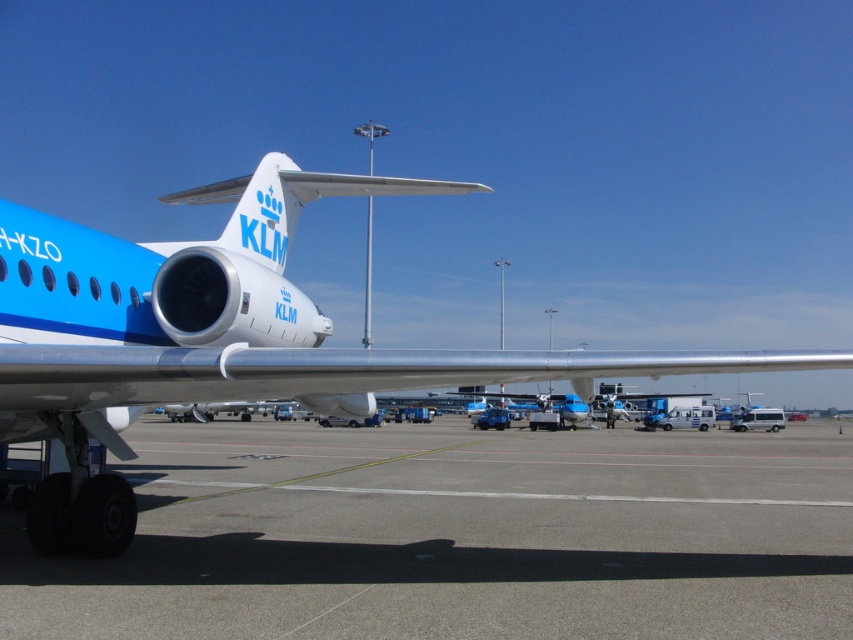
From the picture: You are an airport ground crew member who needs to ensure that the matte blue airplane at center can safely taxi along the gray concrete runway at center. Based on the provided scene description, can the airplane fit on the runway?

The gray concrete runway at center is shorter than the matte blue airplane at center, so the airplane cannot fit on the runway safely.

You are a pilot preparing for takeoff and need to align your plane with the runway. Based on the scene, which direction should you adjust the matte blue airplane at center to properly align it with the gray concrete runway at center?

The gray concrete runway at center is to the right of the matte blue airplane at center, so you should adjust the matte blue airplane at center to the right to align with the runway.